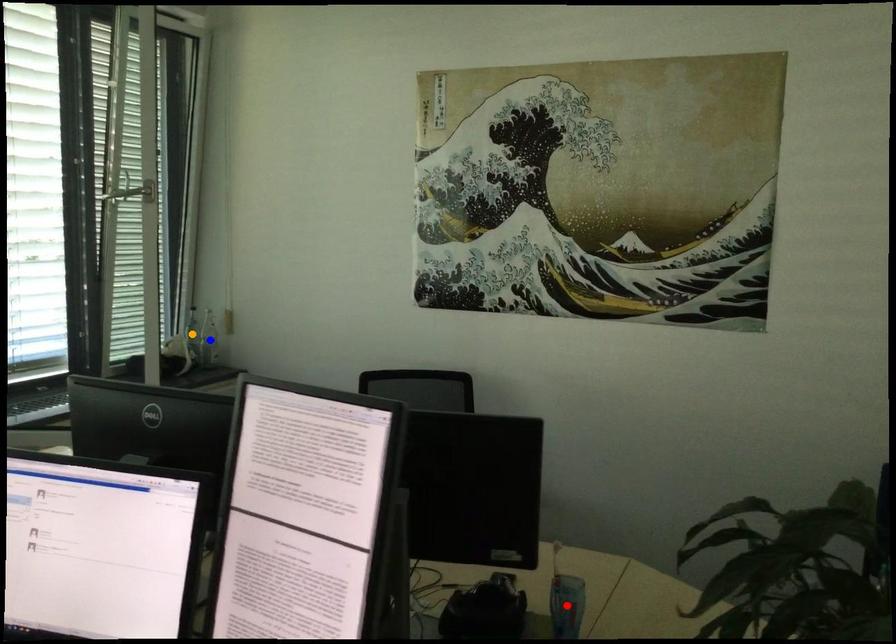
Order these from nearest to farthest:
A) red point
B) blue point
C) orange point

red point < blue point < orange point